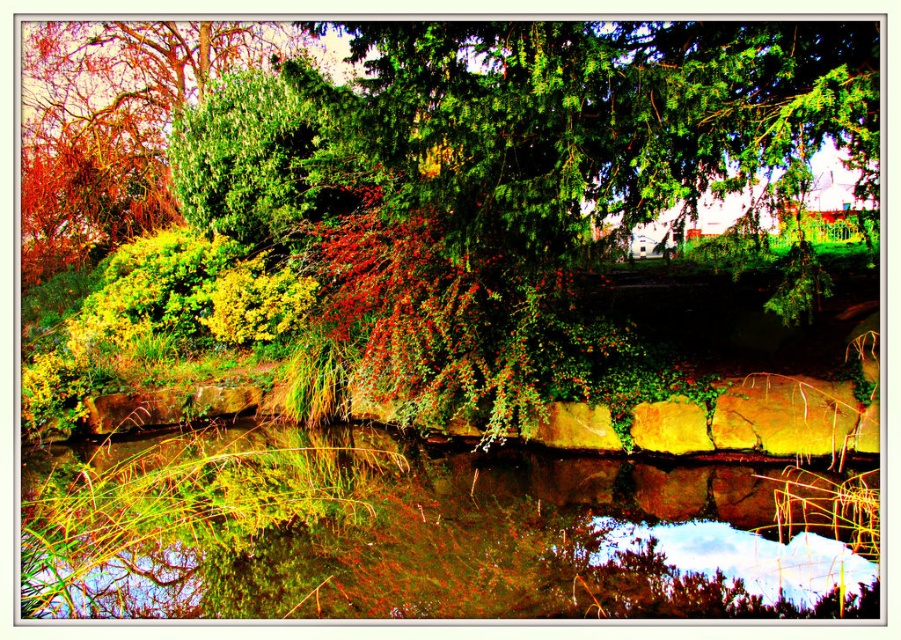
You are a bird looking for a place to perch. You see the green leafy tree at upper center and the green mossy water at center. Which of these two would be a suitable spot for you to land?

The green leafy tree at upper center is taller than the green mossy water at center, so it would be a suitable spot for you to land as trees provide perching branches.

You are a gardener planning to plant a new tree in the garden. You notice the green leafy tree at upper center and the green mossy water at center. Which of these two would require more space to accommodate its size?

The green leafy tree at upper center requires more space because it is larger in size than the green mossy water at center.